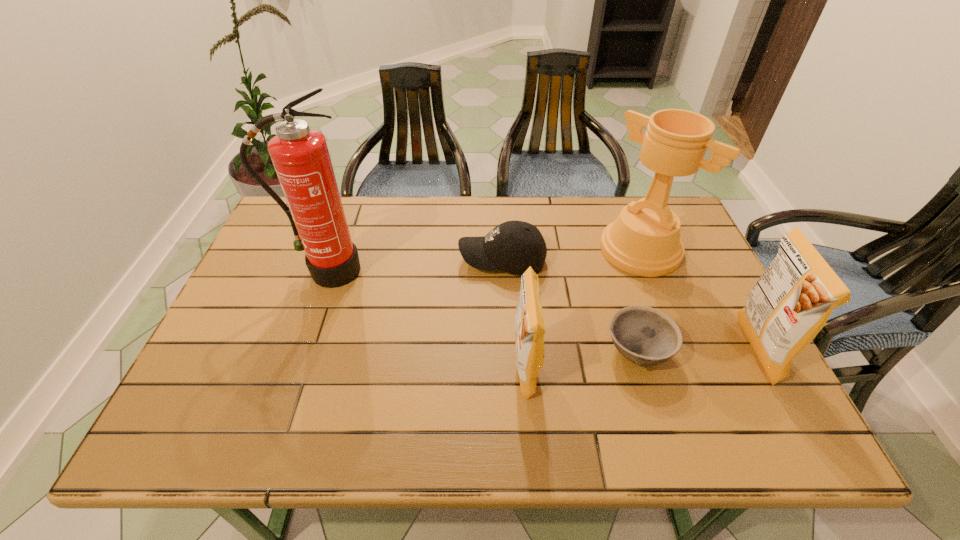
You are a GUI agent. You are given a task and a screenshot of the screen. Output one action in this format:
    pyautogui.click(x=<x>, y=<y>)
    Task: Click on the fourth tallest object
    This screenshot has width=960, height=540.
    Given the screenshot: What is the action you would take?
    529,326

Where is `the shorter crisp (potato chip)`? the shorter crisp (potato chip) is located at coordinates (529, 326).

Find the location of a particular element. The height and width of the screenshot is (540, 960). the right crisp (potato chip) is located at coordinates (791, 302).

Where is `the rightmost object`? Image resolution: width=960 pixels, height=540 pixels. the rightmost object is located at coordinates (791, 302).

This screenshot has width=960, height=540. Identify the location of the second shortest object. (513, 246).

Identify the location of the tallest object. Image resolution: width=960 pixels, height=540 pixels. (300, 156).

Where is `the leftmost object`? The width and height of the screenshot is (960, 540). the leftmost object is located at coordinates (300, 156).

Identify the location of award. The width and height of the screenshot is (960, 540). (644, 240).

The image size is (960, 540). I want to click on bowl, so click(643, 335).

In order to click on free location located 0.270m on the front of the fourth tallest object with the logo in this screenshot , I will do `click(656, 369)`.